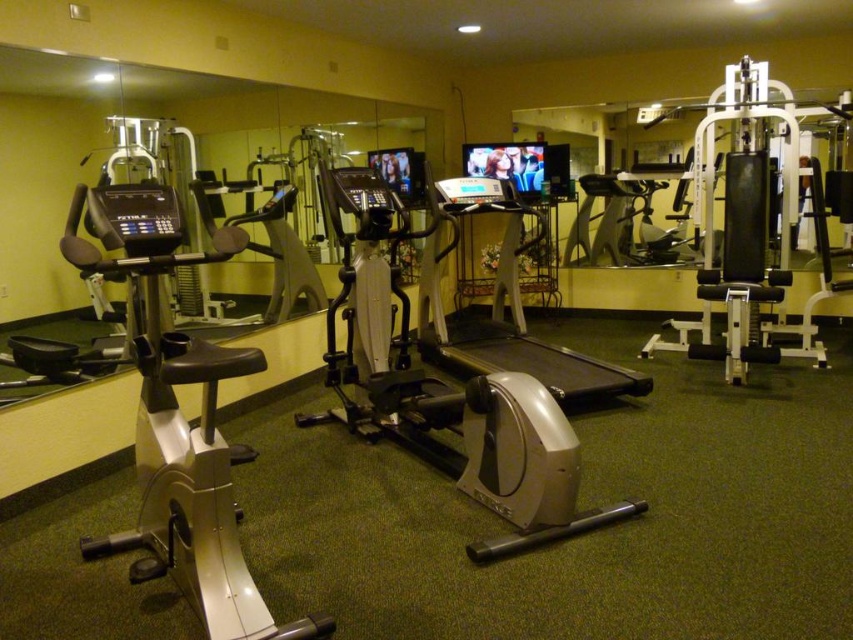
Is silver/plastic elliptical trainer at center wider than silver metallic treadmill at center?

Indeed, silver/plastic elliptical trainer at center has a greater width compared to silver metallic treadmill at center.

Looking at this image, measure the distance from silver/plastic elliptical trainer at center to silver metallic treadmill at center.

silver/plastic elliptical trainer at center and silver metallic treadmill at center are 1.01 meters apart.

Is point (372, 211) more distant than point (595, 369)?

No, it is not.

Locate an element on the screen. The width and height of the screenshot is (853, 640). silver/plastic elliptical trainer at center is located at coordinates (461, 416).